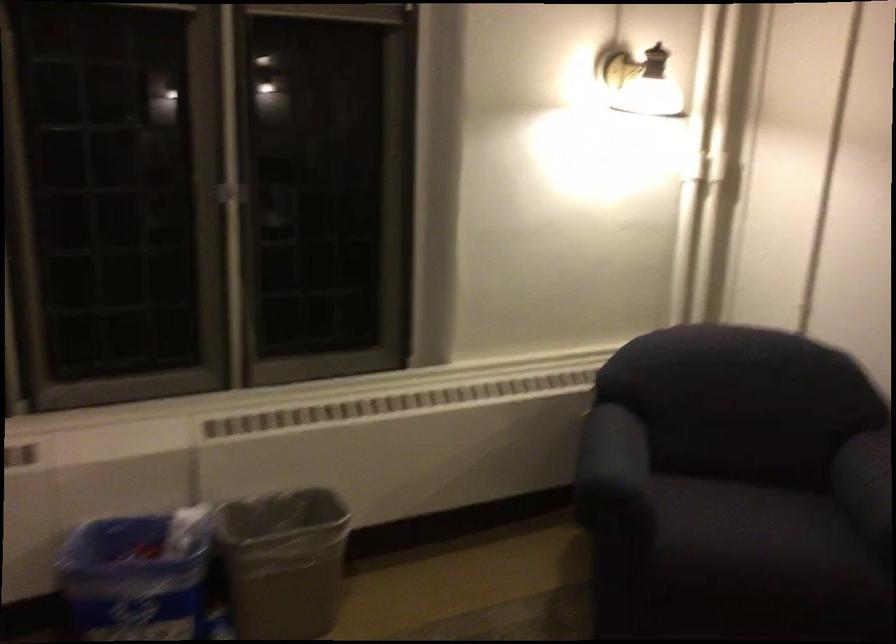
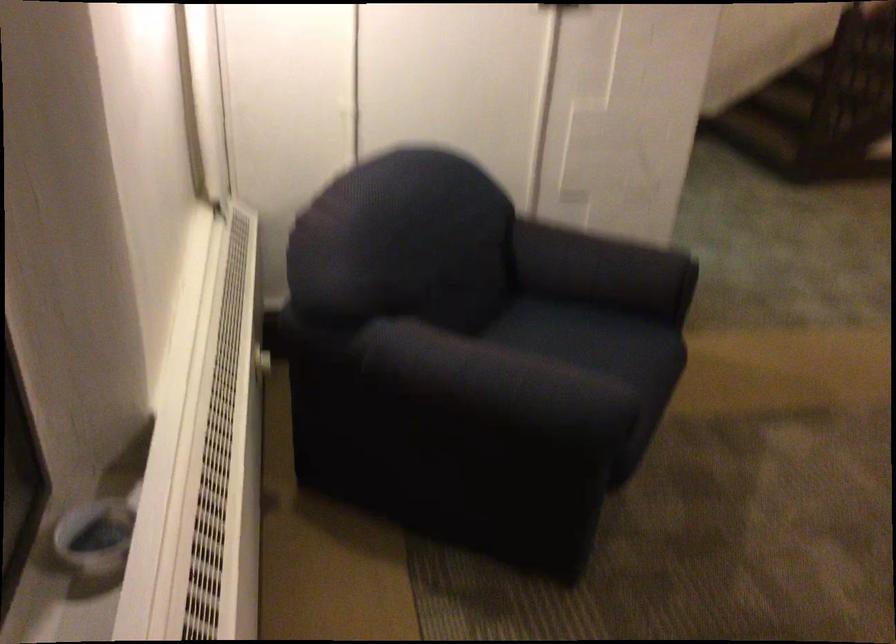
Find the pixel in the second image that matches point 444,390 in the first image.

(218, 462)